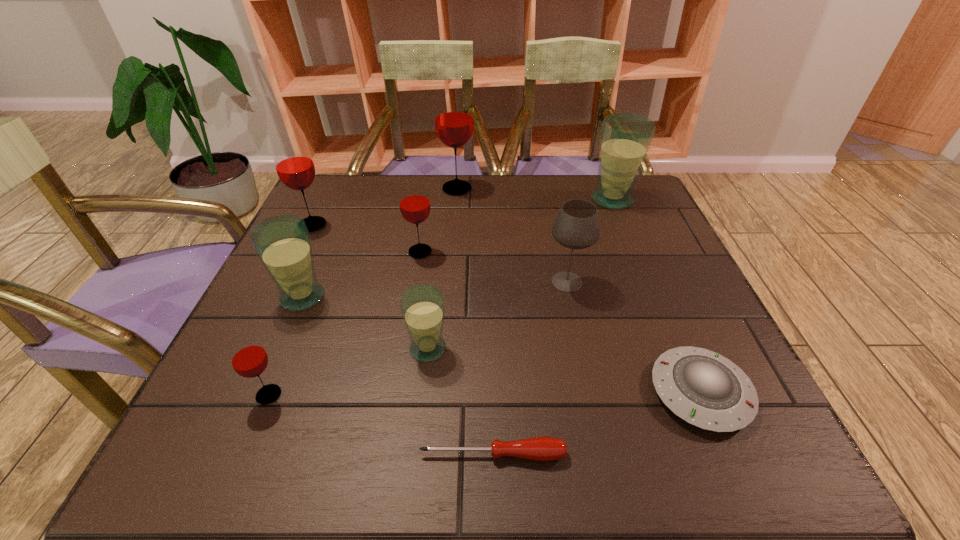
Where is `the tallest object`? The height and width of the screenshot is (540, 960). the tallest object is located at coordinates 453,118.

This screenshot has width=960, height=540. Find the location of `the farthest red glass`. the farthest red glass is located at coordinates (453, 118).

The height and width of the screenshot is (540, 960). I want to click on the second farthest red glass, so click(294, 165).

Locate an element on the screen. The width and height of the screenshot is (960, 540). the third farthest object is located at coordinates (294, 165).

This screenshot has width=960, height=540. In order to click on the farthest blue glass in this screenshot , I will do `click(625, 138)`.

Locate an element on the screen. The height and width of the screenshot is (540, 960). the rightmost glass is located at coordinates (625, 138).

I want to click on wineglass, so point(576,226).

I want to click on gray wineglass, so click(x=576, y=226).

The image size is (960, 540). In order to click on the fourth farthest glass in this screenshot , I will do `click(414, 202)`.

Where is `the third biggest red glass`? This screenshot has width=960, height=540. the third biggest red glass is located at coordinates (414, 202).